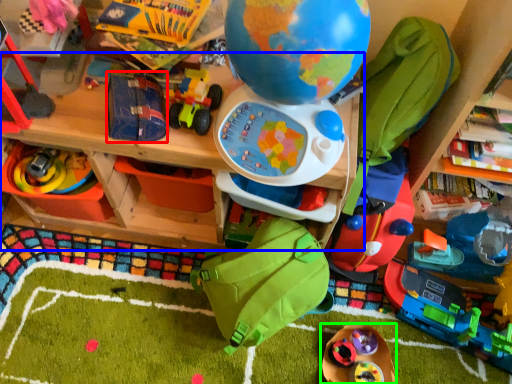
Question: Estimate the real-world distances between objects in this image. Which object is farther from toy (highlighted by a red box), table (highlighted by a blue box) or toy (highlighted by a green box)?

Choices:
 (A) table
 (B) toy

Answer: (B)